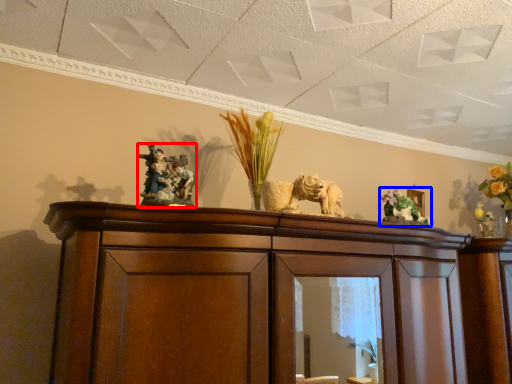
Question: Which point is closer to the camera, animal (highlighted by a red box) or floral arrangement (highlighted by a blue box)?

Choices:
 (A) animal
 (B) floral arrangement

Answer: (A)